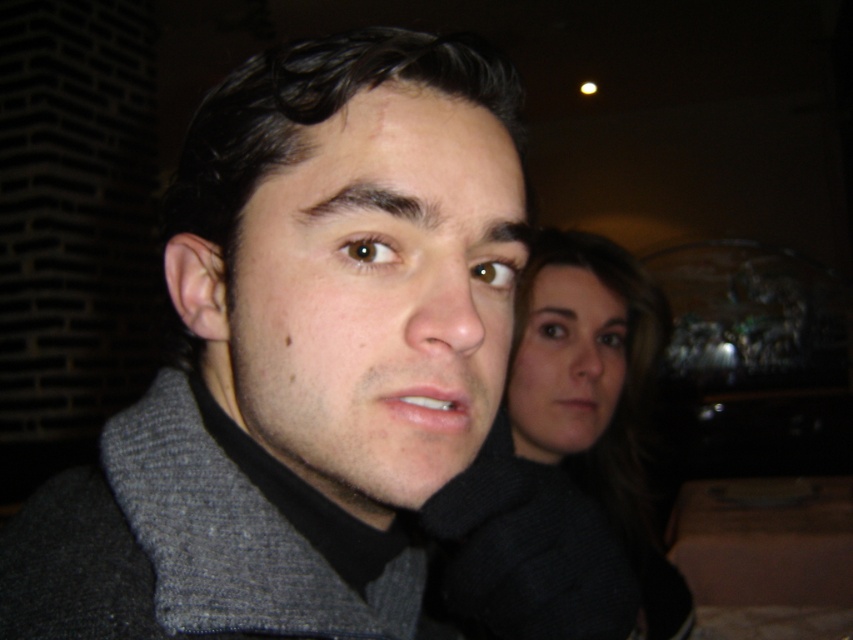
You are trying to decide which clothing item to wear for a cold day. You have the gray fleece jacket at center and the black woolen sweater at center. Based on their thickness, which one would be warmer?

The black woolen sweater at center is thicker than the gray fleece jacket at center, so it would be warmer for a cold day.

You are a fashion designer who needs to create a coordinated outfit using the gray fleece jacket at center and the black woolen sweater at center. Given their proximity in the image, can you determine if the jacket and sweater are meant to be worn together as a set?

The distance between the gray fleece jacket at center and the black woolen sweater at center is 22.17 inches, which suggests they are separate items displayed together but not necessarily a coordinated set.